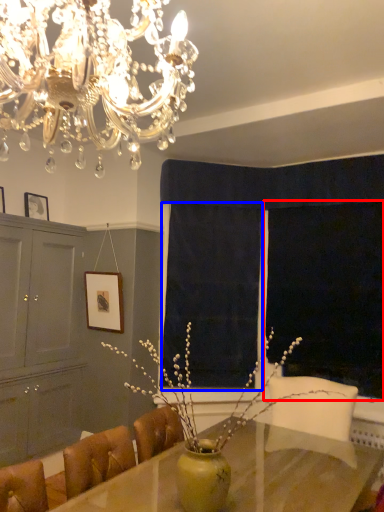
Question: Which object is further to the camera taking this photo, window screen (highlighted by a red box) or curtain (highlighted by a blue box)?

Choices:
 (A) window screen
 (B) curtain

Answer: (B)